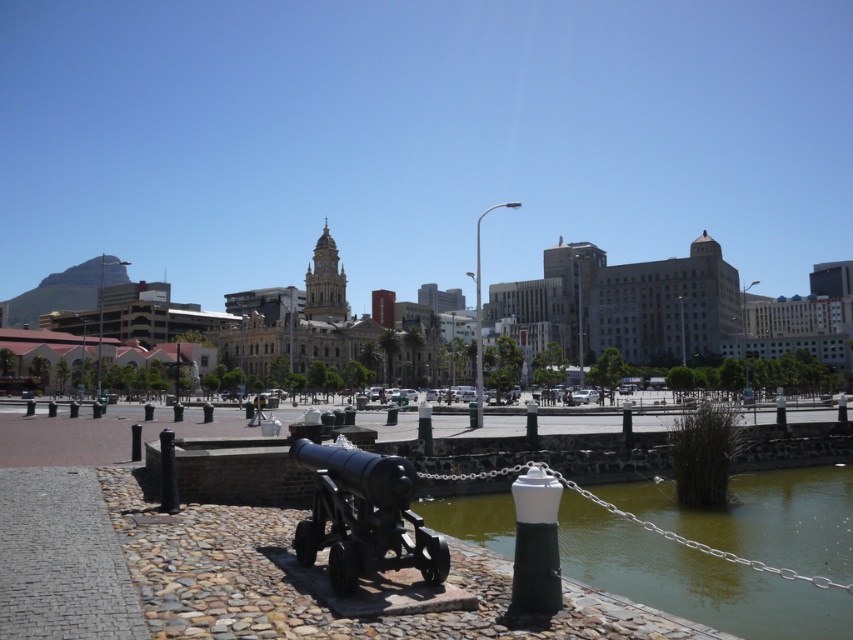
What do you see at coordinates (363, 516) in the screenshot? I see `polished bronze cannon at center` at bounding box center [363, 516].

Is point (384, 500) positioned before point (480, 400)?

Yes, point (384, 500) is closer to viewer.

Find the location of a particular element. Image resolution: width=853 pixels, height=640 pixels. polished bronze cannon at center is located at coordinates (363, 516).

Where is `polished bronze cannon at center`? The width and height of the screenshot is (853, 640). polished bronze cannon at center is located at coordinates (363, 516).

Describe the element at coordinates (692, 579) in the screenshot. The width and height of the screenshot is (853, 640). I see `green stone river at lower center` at that location.

Is point (775, 499) farther from viewer compared to point (482, 410)?

No, (775, 499) is in front of (482, 410).

The width and height of the screenshot is (853, 640). Describe the element at coordinates (692, 579) in the screenshot. I see `green stone river at lower center` at that location.

At what (x,y) coordinates should I click in order to perform the action: click on green stone river at lower center. Please return your answer as a coordinate pair (x, y). Looking at the image, I should click on (692, 579).

Looking at this image, is green stone river at lower center shorter than polished bronze cannon at center?

Yes, green stone river at lower center is shorter than polished bronze cannon at center.

Between green stone river at lower center and polished bronze cannon at center, which one is positioned higher?

polished bronze cannon at center is above.

Which is behind, point (647, 557) or point (321, 547)?

Positioned behind is point (647, 557).

You are a GUI agent. You are given a task and a screenshot of the screen. Output one action in this format:
    pyautogui.click(x=<x>, y=<y>)
    Task: Click on the green stone river at lower center
    This screenshot has height=640, width=853.
    Given the screenshot: What is the action you would take?
    pyautogui.click(x=692, y=579)